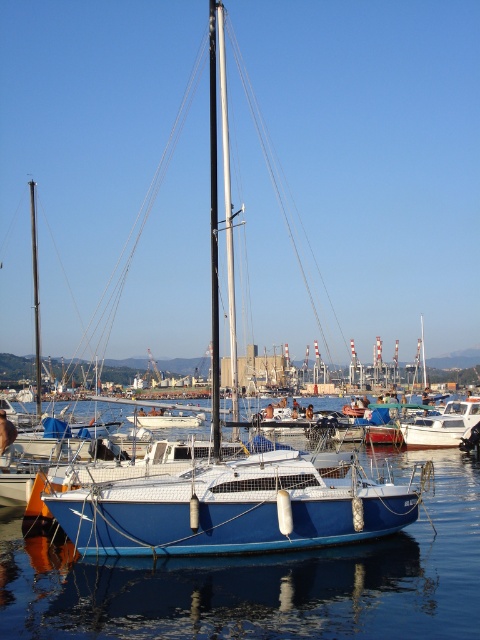
You are a harbor inspector checking the docking arrangements. You need to ensure that the blue matte sailboat at center and the white matte boat at center are spaced appropriately. Based on their sizes, which boat requires more space to be allocated for safe docking?

The white matte boat at center requires more space to be allocated for safe docking since it occupies more space than the blue matte sailboat at center according to the description.

From the picture: You are standing on the dock and want to take a photo of the white glossy sailboat at center and the blue glossy water at center. Which object will appear larger in your camera viewfinder?

The blue glossy water at center will appear larger in the camera viewfinder because it is closer to the viewer than the white glossy sailboat at center.